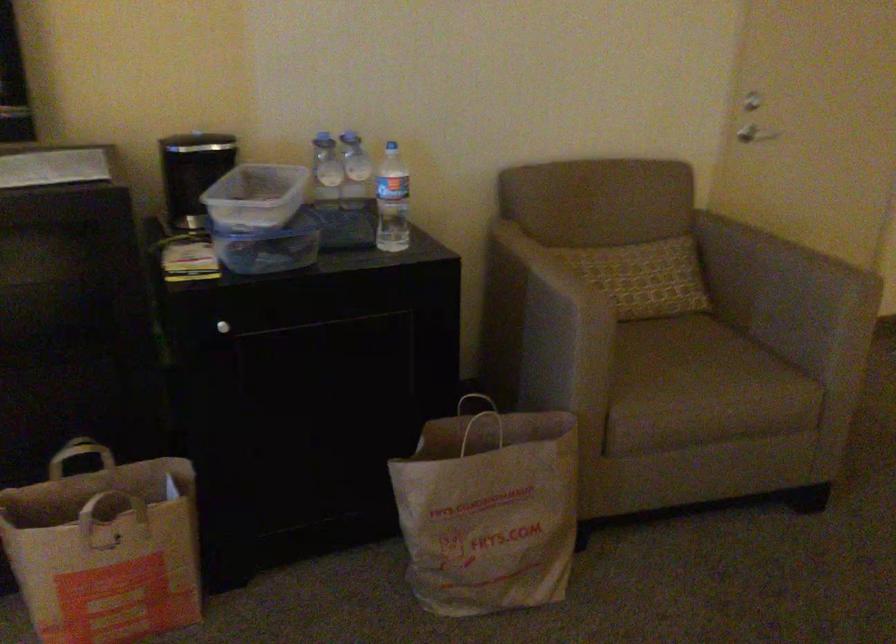
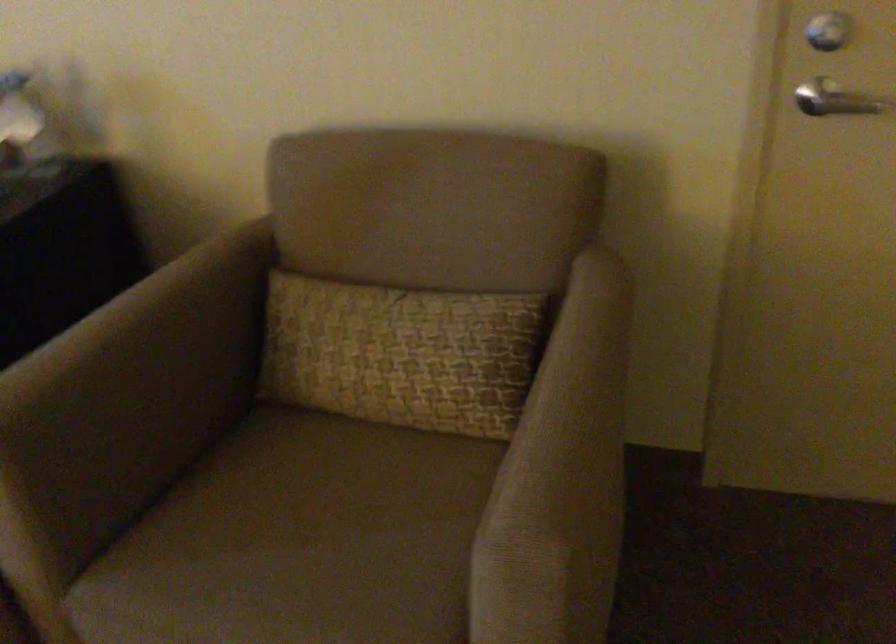
Locate, in the second image, the point that corresponds to point 754,95 in the first image.

(829, 31)